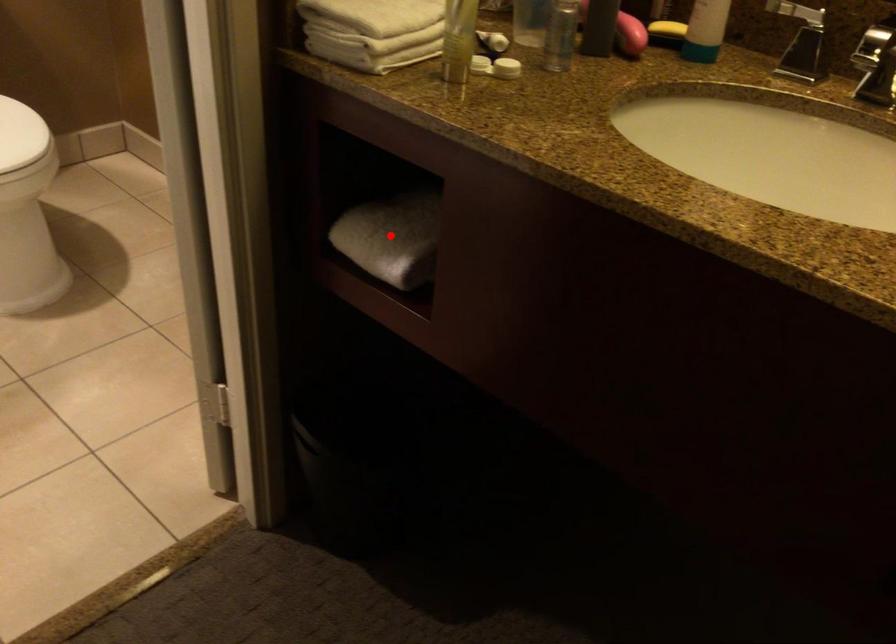
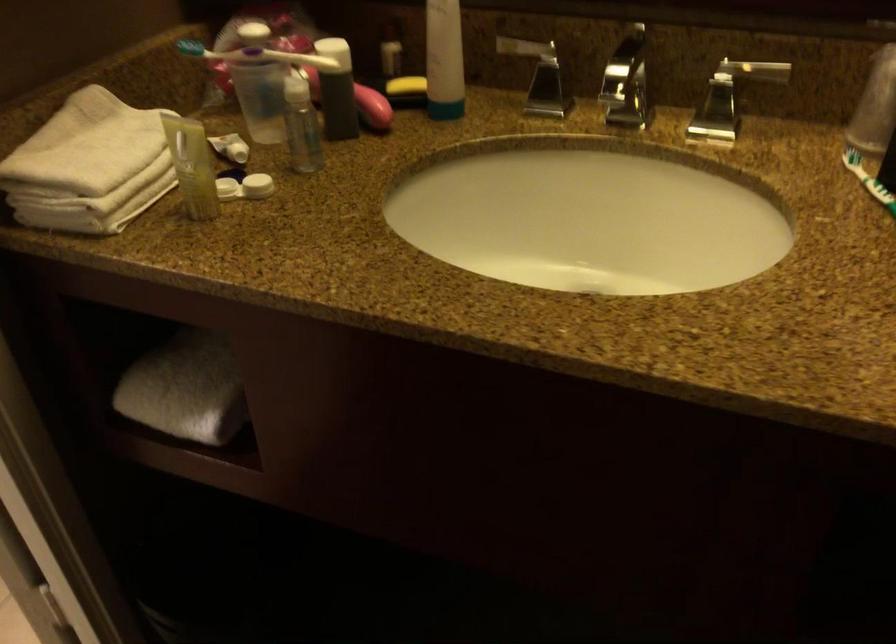
Question: I am providing you with two images of the same scene from different viewpoints. Given a red point in image1, look at the same physical point in image2. Is it:

Choices:
 (A) Closer to the viewpoint
 (B) Farther from the viewpoint

Answer: (A)